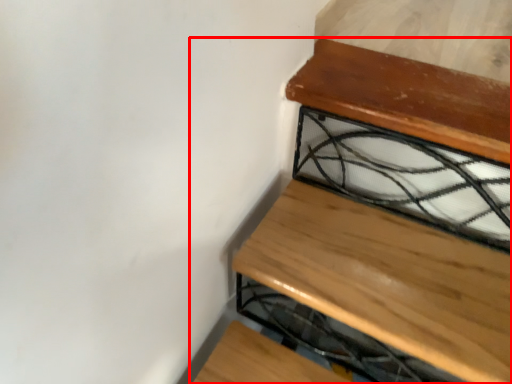
Question: From the image's perspective, what is the correct spatial relationship of furniture (annotated by the red box) in relation to glass window?

Choices:
 (A) above
 (B) below

Answer: (B)